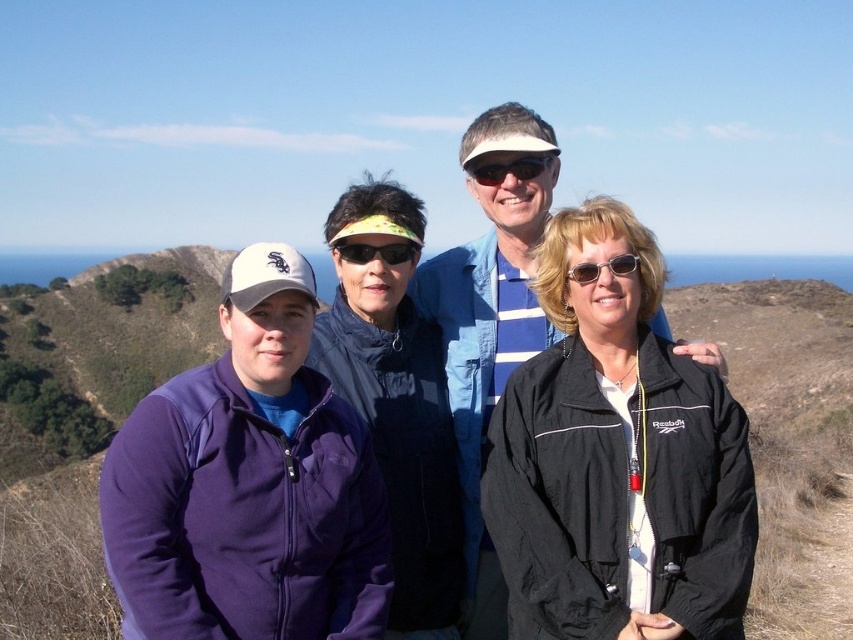
Question: Does blue striped shirt at center lie in front of black plastic sunglasses at center?

Choices:
 (A) no
 (B) yes

Answer: (B)

Question: Among these points, which one is farthest from the camera?

Choices:
 (A) (503, 172)
 (B) (456, 364)
 (C) (384, 257)
 (D) (396, 531)

Answer: (A)

Question: Which of the following is the closest to the observer?

Choices:
 (A) (587, 282)
 (B) (523, 176)
 (C) (399, 428)
 (D) (451, 296)

Answer: (A)

Question: Is dark blue jacket at center closer to the viewer compared to black matte sunglasses at center?

Choices:
 (A) yes
 (B) no

Answer: (A)

Question: Which point is farther to the camera?

Choices:
 (A) (625, 257)
 (B) (462, 472)
 (C) (393, 428)
 (D) (502, 179)

Answer: (D)

Question: Is the position of dark blue jacket at center more distant than that of blue striped shirt at center?

Choices:
 (A) no
 (B) yes

Answer: (A)